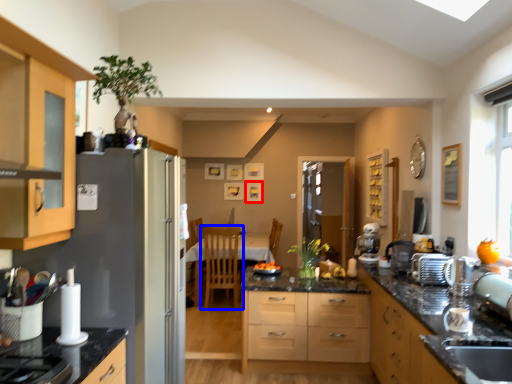
Question: Which object is further to the camera taking this photo, picture frame (highlighted by a red box) or chair (highlighted by a blue box)?

Choices:
 (A) picture frame
 (B) chair

Answer: (A)